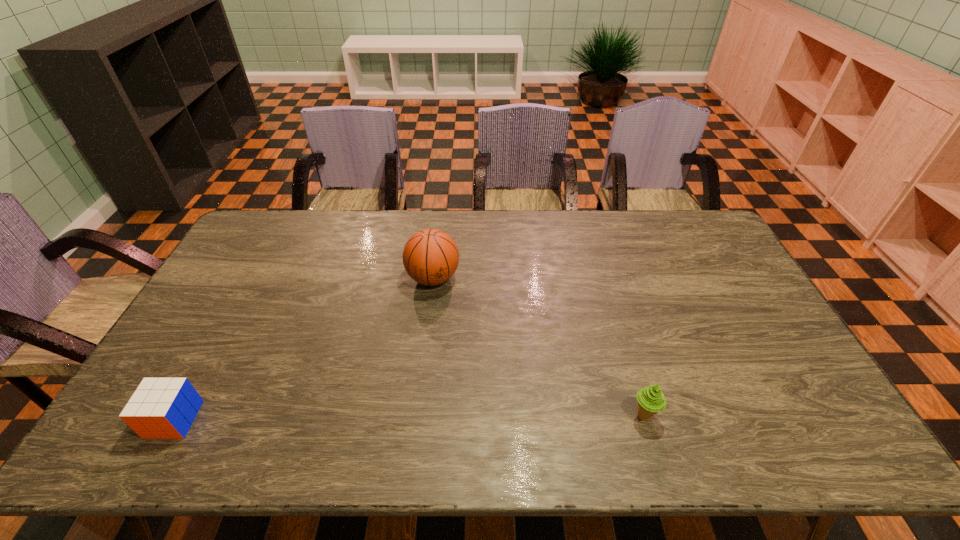
The width and height of the screenshot is (960, 540). I want to click on vacant region that satisfies the following two spatial constraints: 1. on the back side of the cube; 2. on the left side of the second tallest object, so click(x=176, y=416).